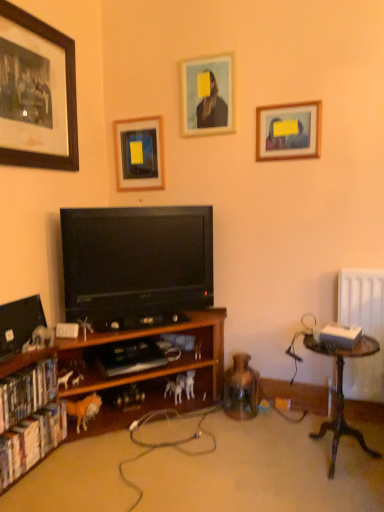
Image resolution: width=384 pixels, height=512 pixels. In order to click on blank space situated above matte black picture frame at upper left, which is counted as the 4th picture frame, starting from the right (from a real-world perspective) in this screenshot , I will do `click(28, 13)`.